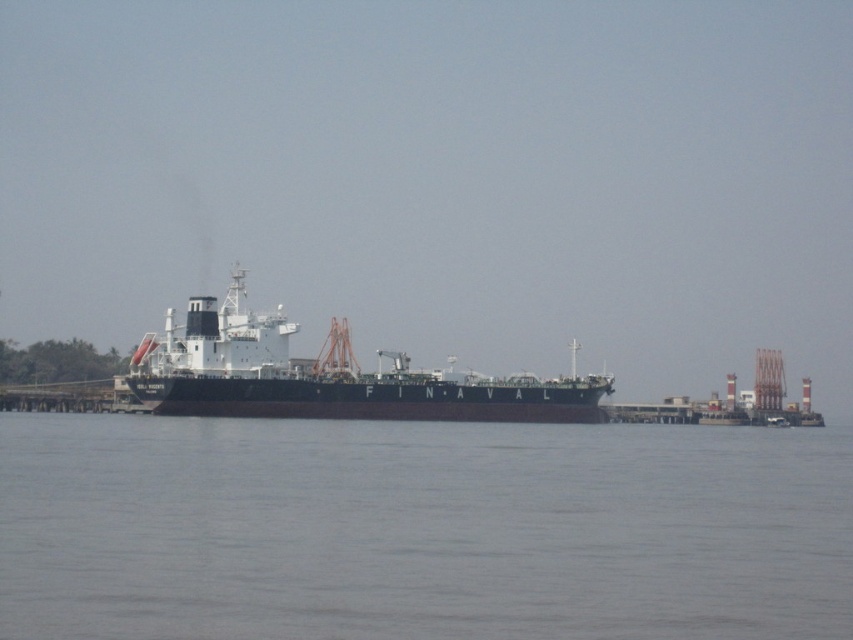
Can you confirm if gray water at center is thinner than black matte ship at center?

In fact, gray water at center might be wider than black matte ship at center.

Can you confirm if gray water at center is shorter than black matte ship at center?

Correct, gray water at center is not as tall as black matte ship at center.

Which is in front, point (553, 429) or point (527, 392)?

Point (553, 429) is in front.

What are the coordinates of `gray water at center` in the screenshot? It's located at (421, 529).